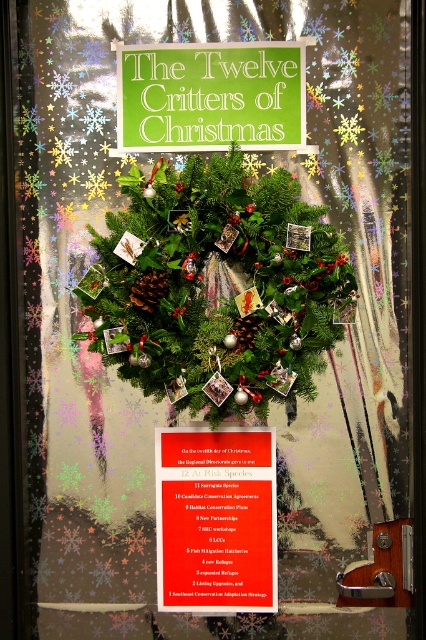
You are standing in front of the festive glass door display. There are two points marked on the door at coordinates point [161,328] and point [236,564]. Which point is closer to you?

Point [161,328] is further to the camera than point [236,564], so the point closer to you is point [236,564].

You are an event organizer setting up a conservation booth. You have two items to display on a narrow table that can only fit one item. The matte red poster at center and the brown textured pine cone at center are both candidates. Which item should you choose to ensure it fits better on the table?

The matte red poster at center has a greater width than the brown textured pine cone at center, so the pine cone will fit better on the narrow table.